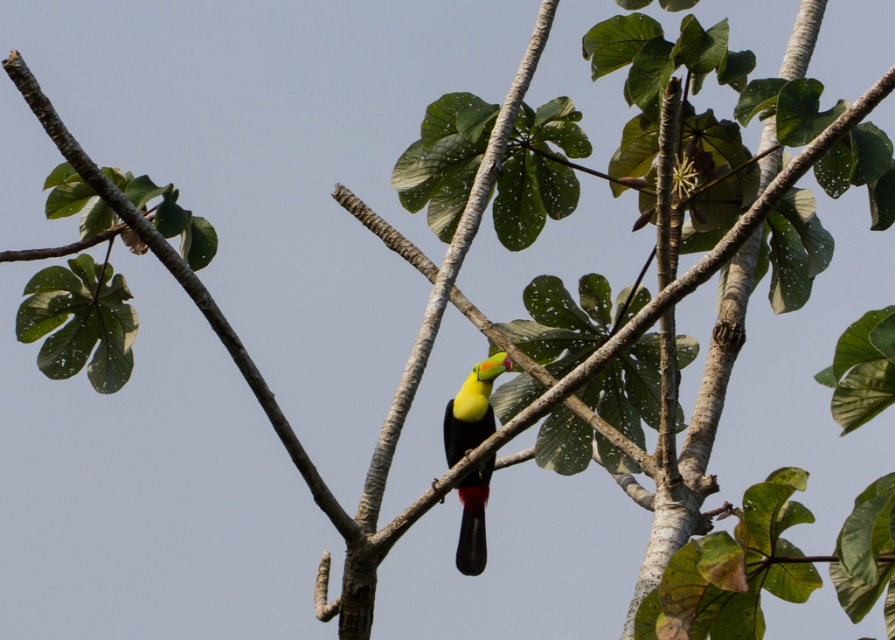
Question: Among these objects, which one is nearest to the camera?

Choices:
 (A) yellow matte parrot at center
 (B) green matte leaf at upper left

Answer: (B)

Question: Which point is closer to the camera?

Choices:
 (A) click(x=475, y=440)
 (B) click(x=201, y=291)

Answer: (B)

Question: Can you confirm if green matte leaf at upper left is positioned below yellow matte parrot at center?

Choices:
 (A) yes
 (B) no

Answer: (B)

Question: Is green matte leaf at upper left above yellow matte parrot at center?

Choices:
 (A) no
 (B) yes

Answer: (B)

Question: Is green matte leaf at upper left bigger than yellow matte parrot at center?

Choices:
 (A) yes
 (B) no

Answer: (A)

Question: Among these objects, which one is farthest from the camera?

Choices:
 (A) yellow matte parrot at center
 (B) green matte leaf at upper left

Answer: (A)